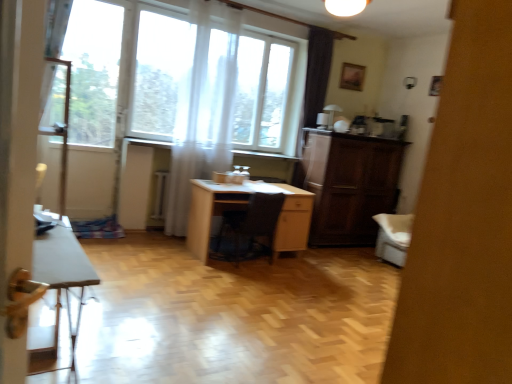
Question: Considering the relative sizes of white glossy table at lower left and white sheer curtain at upper center in the image provided, is white glossy table at lower left wider than white sheer curtain at upper center?

Choices:
 (A) no
 (B) yes

Answer: (B)

Question: Is white glossy table at lower left surrounding white sheer curtain at upper center?

Choices:
 (A) yes
 (B) no

Answer: (B)

Question: Does white glossy table at lower left have a lesser width compared to white sheer curtain at upper center?

Choices:
 (A) yes
 (B) no

Answer: (B)

Question: Is white glossy table at lower left at the left side of white sheer curtain at upper center?

Choices:
 (A) no
 (B) yes

Answer: (B)

Question: Would you say white glossy table at lower left is outside white sheer curtain at upper center?

Choices:
 (A) yes
 (B) no

Answer: (A)

Question: Based on their positions, is white glossy cabinet at right located to the left or right of white glossy table at lower left?

Choices:
 (A) right
 (B) left

Answer: (A)

Question: Considering the positions of white glossy cabinet at right and white glossy table at lower left in the image, is white glossy cabinet at right taller or shorter than white glossy table at lower left?

Choices:
 (A) short
 (B) tall

Answer: (B)

Question: Is white glossy cabinet at right spatially inside white glossy table at lower left, or outside of it?

Choices:
 (A) inside
 (B) outside

Answer: (B)

Question: From a real-world perspective, is white glossy cabinet at right above or below white glossy table at lower left?

Choices:
 (A) above
 (B) below

Answer: (A)

Question: From a real-world perspective, is white sheer curtain at upper center above or below black leather chair at center?

Choices:
 (A) below
 (B) above

Answer: (B)

Question: Considering the positions of point (206, 132) and point (240, 213), is point (206, 132) closer or farther from the camera than point (240, 213)?

Choices:
 (A) closer
 (B) farther

Answer: (B)

Question: Looking at their shapes, would you say white sheer curtain at upper center is wider or thinner than black leather chair at center?

Choices:
 (A) wide
 (B) thin

Answer: (B)

Question: In the image, is white sheer curtain at upper center positioned in front of or behind black leather chair at center?

Choices:
 (A) behind
 (B) front

Answer: (A)

Question: From the image's perspective, is transparent fabric at left positioned above or below white glossy cabinet at right?

Choices:
 (A) above
 (B) below

Answer: (A)

Question: Considering the positions of transparent fabric at left and white glossy cabinet at right in the image, is transparent fabric at left bigger or smaller than white glossy cabinet at right?

Choices:
 (A) small
 (B) big

Answer: (A)